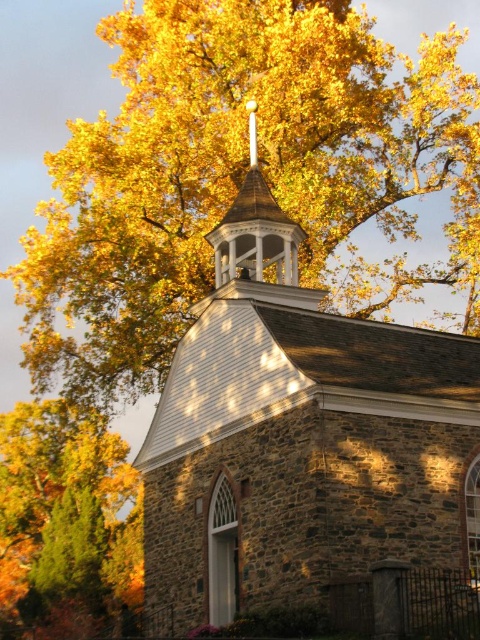
You are standing in front of the church and want to know how far the point at coordinates (240, 257) is from you. Can you determine the distance?

The point at coordinates (240, 257) is 51.60 meters away from the viewer.

You are standing in front of the church and see two points marked on the ground. One is at point (151, 51) and the other at point (19, 452). Which point is closer to the entrance of the church?

Point (151, 51) is in front of point (19, 452), so it is closer to the entrance of the church.